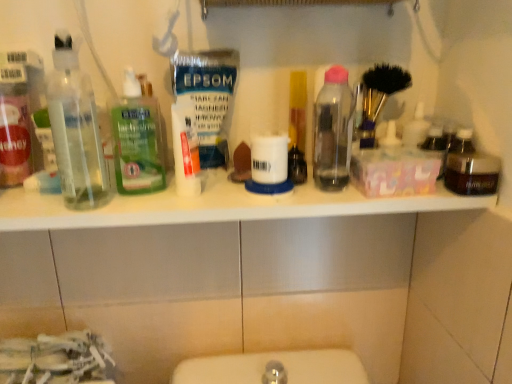
Question: From the image's perspective, relative to green translucent liquid at center, which appears as the 3th bottle when viewed from the right, is white plastic shelf at upper center above or below?

Choices:
 (A) below
 (B) above

Answer: (A)

Question: Is point (375, 203) positioned closer to the camera than point (160, 152)?

Choices:
 (A) farther
 (B) closer

Answer: (B)

Question: Which object is the closest to the white plastic shelf at upper center?

Choices:
 (A) dark brown glass jar at right, which is counted as the 4th bottle, starting from the left
 (B) green translucent liquid at center, arranged as the second bottle when viewed from the left
 (C) transparent plastic bottles at left, which appears as the first bottle when viewed from the left
 (D) white matte tube at center
 (E) transparent plastic bottle at center, arranged as the third bottle when viewed from the left

Answer: (B)

Question: Which object is the closest to the translucent plastic bottle at center?

Choices:
 (A) white plastic shelf at upper center
 (B) green translucent liquid at center, arranged as the second bottle when viewed from the left
 (C) white matte tube at center
 (D) transparent plastic bottles at left, which appears as the first bottle when viewed from the left
 (E) transparent plastic bottle at center, which is the second bottle from right to left

Answer: (E)